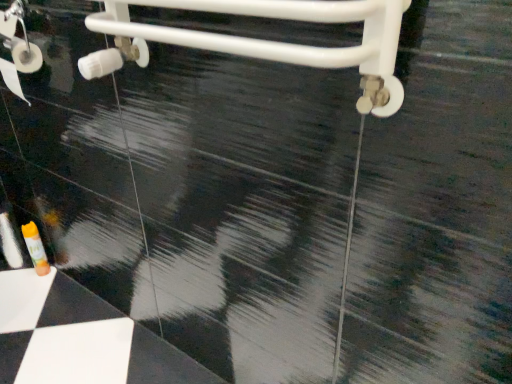
From the picture: Measure the distance between point (42, 266) and camera.

Point (42, 266) is 1.69 meters away from camera.

Locate an element on the screen. This screenshot has width=512, height=384. translucent orange tube at lower left is located at coordinates (35, 248).

Image resolution: width=512 pixels, height=384 pixels. What do you see at coordinates (35, 248) in the screenshot?
I see `translucent orange tube at lower left` at bounding box center [35, 248].

Where is `translucent orange tube at lower left`? The image size is (512, 384). translucent orange tube at lower left is located at coordinates (35, 248).